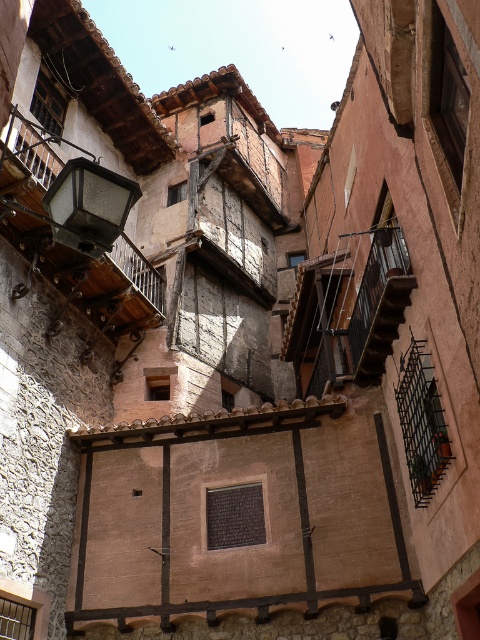
You are a tourist standing at the entrance of the alleyway and want to take a photo of the wooden balcony at left and the wooden stairs at center. Which one should you focus on first to ensure both are in the frame?

The wooden balcony at left is in front of the wooden stairs at center, so you should focus on the wooden balcony at left first to ensure both are in the frame.

You are standing in the middle of the alleyway and want to hang a new lantern. The existing matte black lantern at upper left is located at coordinates point 0.322, 0.185. If you want to place your new lantern 0.1 units to the right and 0.05 units down from the existing one, what would be the new coordinates?

The new coordinates would be calculated by adding 0.1 to the x coordinate and 0.05 to the y coordinate of the existing matte black lantern at upper left. The new coordinates would be approximately (112, 269).